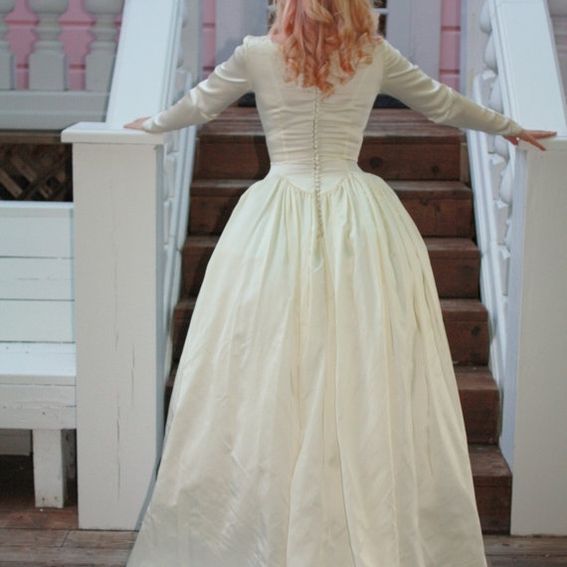
You are a GUI agent. You are given a task and a screenshot of the screen. Output one action in this format:
    pyautogui.click(x=<x>, y=<y>)
    Task: Click on the stair rails
    The width and height of the screenshot is (567, 567).
    Given the screenshot: What is the action you would take?
    pyautogui.click(x=158, y=71), pyautogui.click(x=507, y=32)